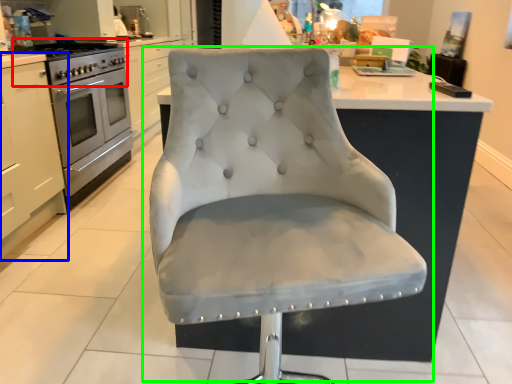
Question: Considering the real-world distances, which object is closest to gas stove (highlighted by a red box)? cabinetry (highlighted by a blue box) or chair (highlighted by a green box).

Choices:
 (A) cabinetry
 (B) chair

Answer: (A)